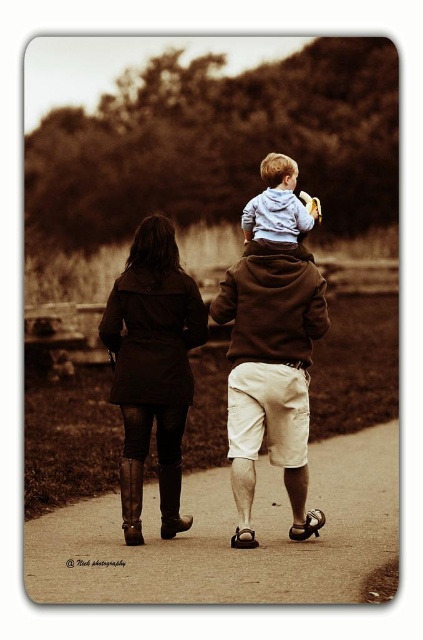
You are a photographer standing on the smooth asphalt path at center. You want to take a photo of the dark brown leather coat at center. Since the path is lower than the coat, where should you position yourself to ensure the coat is fully visible in your shot?

The smooth asphalt path at center is lower than the dark brown leather coat at center. To ensure the coat is fully visible, you should position yourself at a lower elevation or angle your camera upwards.

You are a delivery drone that needs to fly from the smooth asphalt path at center to the dark brown leather coat at center. What is the minimum vertical distance you need to maintain to avoid collision?

The minimum vertical distance required is 7.41 feet to ensure safe passage between the smooth asphalt path at center and the dark brown leather coat at center.